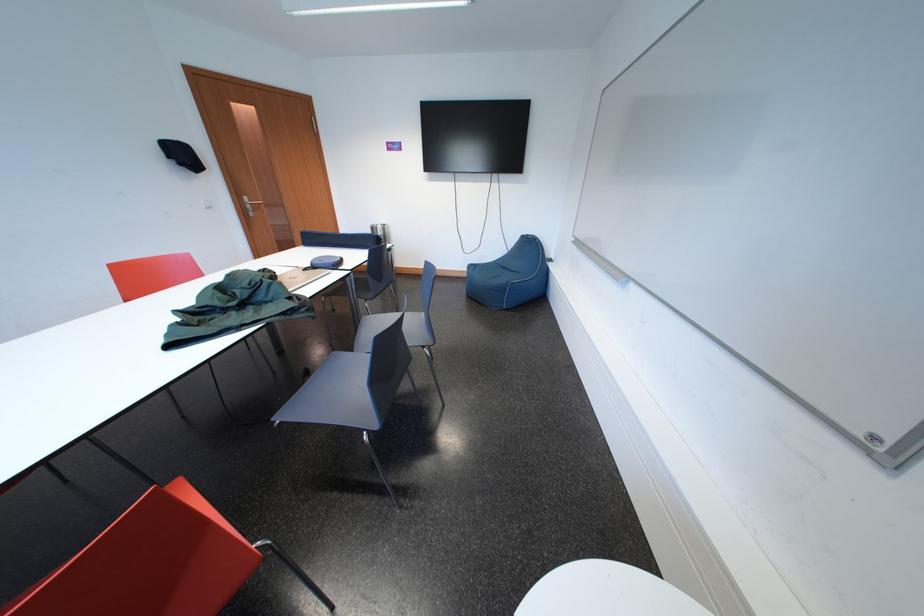
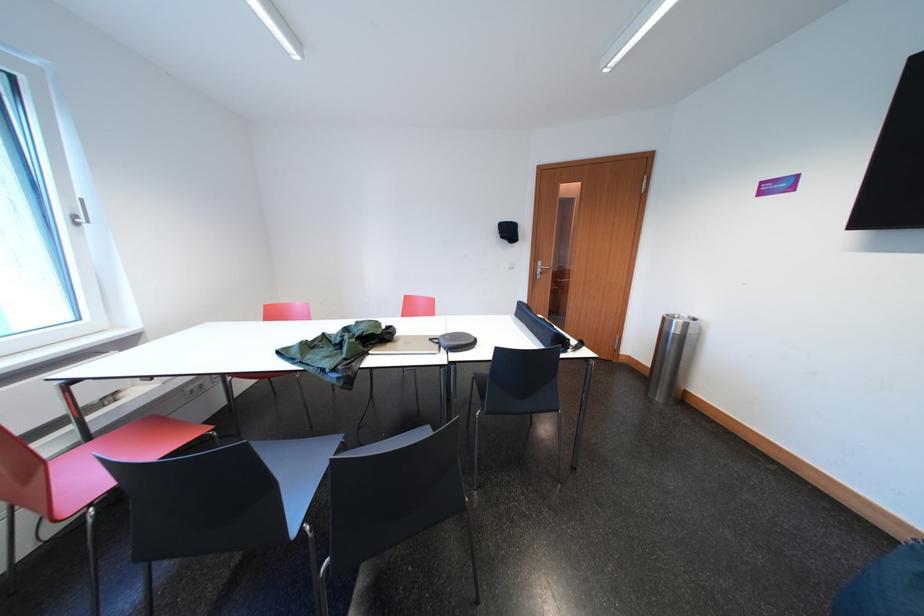
In the second image, find the point that corresponds to (x=237, y=280) in the first image.

(367, 326)